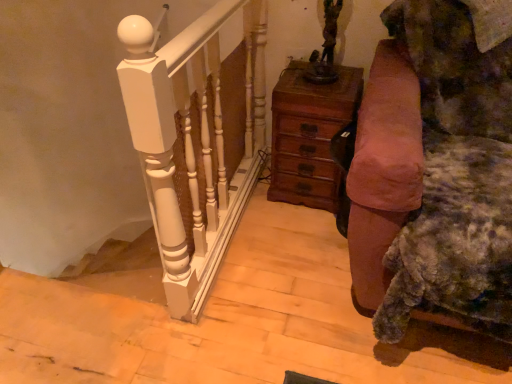
Where is `wooden chest of drawers at center`? Image resolution: width=512 pixels, height=384 pixels. wooden chest of drawers at center is located at coordinates pos(309,134).

The image size is (512, 384). What do you see at coordinates (309, 134) in the screenshot?
I see `wooden chest of drawers at center` at bounding box center [309, 134].

Where is `velvet brown couch at right`? velvet brown couch at right is located at coordinates (408, 211).

Describe the element at coordinates (408, 211) in the screenshot. I see `velvet brown couch at right` at that location.

What is the approximate height of velvet brown couch at right?

velvet brown couch at right is 35.29 inches in height.

Where is `wooden chest of drawers at center`? wooden chest of drawers at center is located at coordinates (309, 134).

Can you confirm if wooden chest of drawers at center is positioned to the left of velvet brown couch at right?

Yes, wooden chest of drawers at center is to the left of velvet brown couch at right.

Considering the positions of objects wooden chest of drawers at center and velvet brown couch at right in the image provided, who is behind, wooden chest of drawers at center or velvet brown couch at right?

wooden chest of drawers at center is more distant.

Which point is more distant from viewer, (x=298, y=65) or (x=411, y=253)?

Positioned behind is point (x=298, y=65).

From the image's perspective, between wooden chest of drawers at center and velvet brown couch at right, which one is located above?

wooden chest of drawers at center is shown above in the image.

From a real-world perspective, between wooden chest of drawers at center and velvet brown couch at right, who is vertically higher?

In real-world perspective, velvet brown couch at right is above.

Considering the sizes of objects wooden chest of drawers at center and velvet brown couch at right in the image provided, who is wider, wooden chest of drawers at center or velvet brown couch at right?

With larger width is velvet brown couch at right.

Between wooden chest of drawers at center and velvet brown couch at right, which one has more height?

velvet brown couch at right.

Does wooden chest of drawers at center have a smaller size compared to velvet brown couch at right?

Yes, wooden chest of drawers at center is smaller than velvet brown couch at right.

Is velvet brown couch at right surrounded by wooden chest of drawers at center?

That's incorrect, velvet brown couch at right is not inside wooden chest of drawers at center.

Is wooden chest of drawers at center positioned far away from velvet brown couch at right?

No, wooden chest of drawers at center is not far from velvet brown couch at right.

Is wooden chest of drawers at center oriented away from velvet brown couch at right?

wooden chest of drawers at center is not turned away from velvet brown couch at right.

How different are the orientations of wooden chest of drawers at center and velvet brown couch at right in degrees?

The angle between the facing direction of wooden chest of drawers at center and the facing direction of velvet brown couch at right is 1.24 degrees.

Measure the distance from wooden chest of drawers at center to velvet brown couch at right.

They are 18.04 inches apart.

There is a wooden chest of drawers at center. Identify the location of furniture above it (from a real-world perspective). (408, 211).

Which object is positioned more to the left, velvet brown couch at right or wooden chest of drawers at center?

Positioned to the left is wooden chest of drawers at center.

Which object is further away from the camera taking this photo, velvet brown couch at right or wooden chest of drawers at center?

wooden chest of drawers at center is further away from the camera.

Which point is more distant from viewer, (391, 170) or (293, 113)?

The point (293, 113) is behind.

From the image's perspective, is velvet brown couch at right over wooden chest of drawers at center?

Incorrect, from the image's perspective, velvet brown couch at right is lower than wooden chest of drawers at center.

From a real-world perspective, is velvet brown couch at right above or below wooden chest of drawers at center?

Clearly, from a real-world perspective, velvet brown couch at right is above wooden chest of drawers at center.

Does velvet brown couch at right have a greater width compared to wooden chest of drawers at center?

Correct, the width of velvet brown couch at right exceeds that of wooden chest of drawers at center.

Does velvet brown couch at right have a greater height compared to wooden chest of drawers at center?

Indeed, velvet brown couch at right has a greater height compared to wooden chest of drawers at center.

Who is smaller, velvet brown couch at right or wooden chest of drawers at center?

wooden chest of drawers at center.

Is velvet brown couch at right completely or partially outside of wooden chest of drawers at center?

Yes, velvet brown couch at right is located beyond the bounds of wooden chest of drawers at center.

Is velvet brown couch at right not close to wooden chest of drawers at center?

No.

Is velvet brown couch at right looking in the opposite direction of wooden chest of drawers at center?

No, velvet brown couch at right is not facing the opposite direction of wooden chest of drawers at center.

What's the angular difference between velvet brown couch at right and wooden chest of drawers at center's facing directions?

The angular difference between velvet brown couch at right and wooden chest of drawers at center is 1.24 degrees.

At what (x,y) coordinates should I click in order to perform the action: click on chest of drawers on the left of velvet brown couch at right. Please return your answer as a coordinate pair (x, y). The width and height of the screenshot is (512, 384). Looking at the image, I should click on (309, 134).

Identify the location of the chest of drawers directly beneath the velvet brown couch at right (from a real-world perspective). (309, 134).

Where is `the chest of drawers lying behind the velvet brown couch at right`? The image size is (512, 384). the chest of drawers lying behind the velvet brown couch at right is located at coordinates (309, 134).